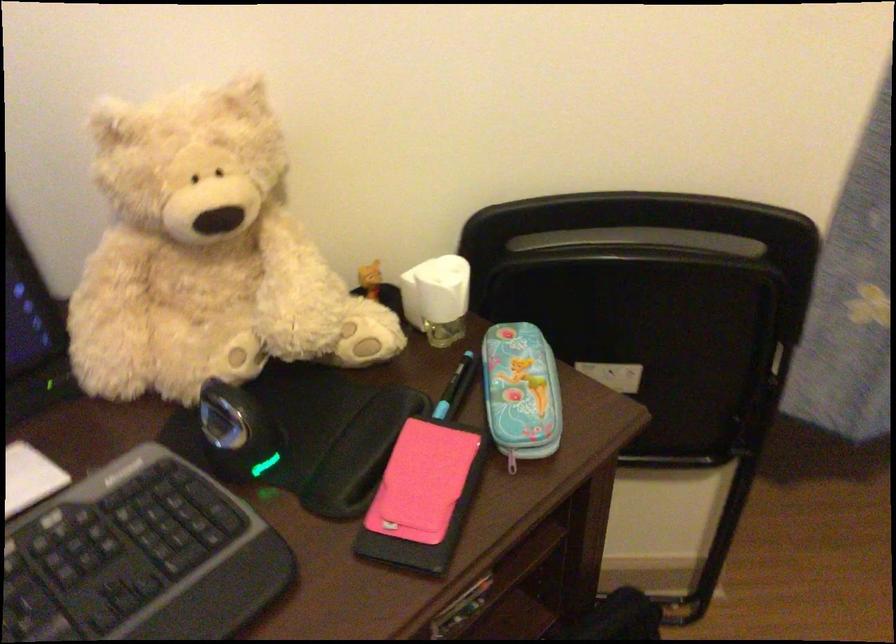
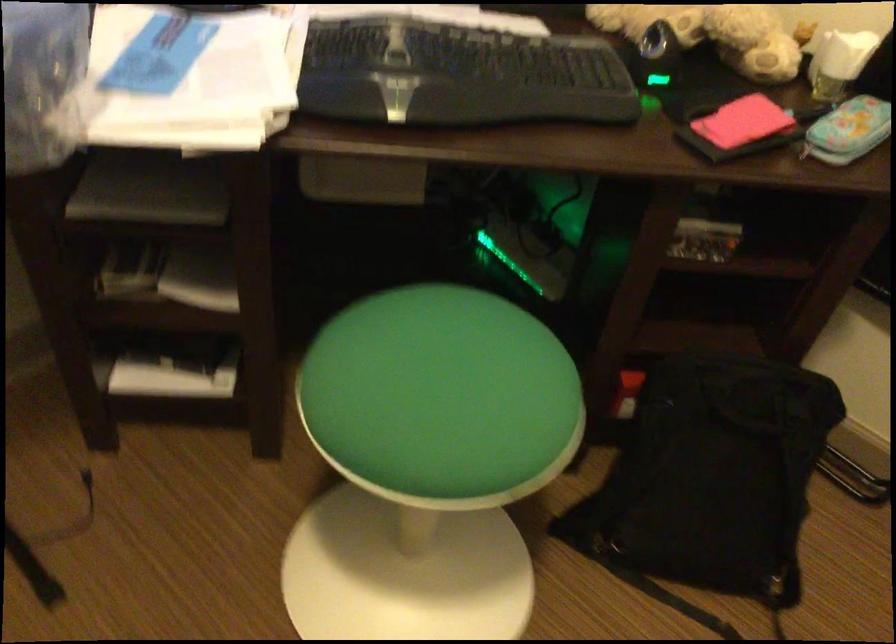
Locate, in the second image, the point that corresponds to the point at 442,498 in the first image.

(739, 128)